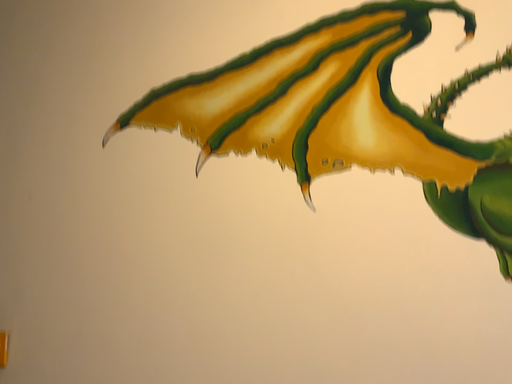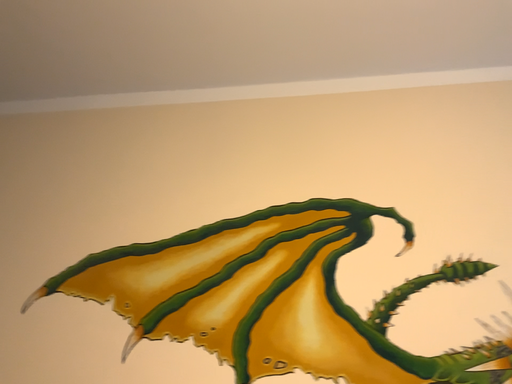
Question: Which way did the camera rotate in the video?

Choices:
 (A) rotated right
 (B) rotated left

Answer: (A)